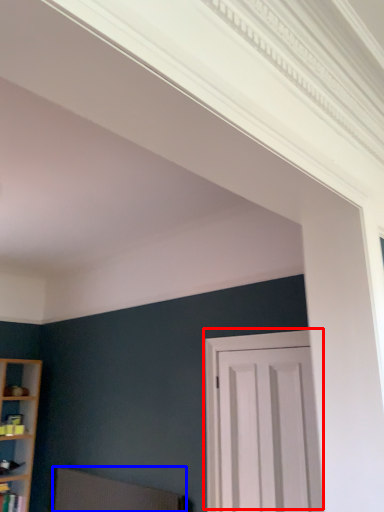
Question: Which object is further to the camera taking this photo, door (highlighted by a red box) or swivel chair (highlighted by a blue box)?

Choices:
 (A) door
 (B) swivel chair

Answer: (B)